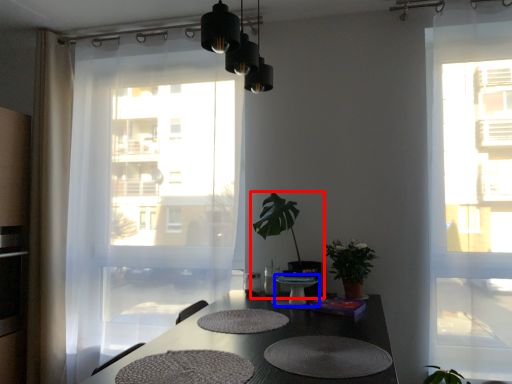
Question: Among these objects, which one is farthest to the camera, houseplant (highlighted by a red box) or round table (highlighted by a blue box)?

Choices:
 (A) houseplant
 (B) round table

Answer: (A)